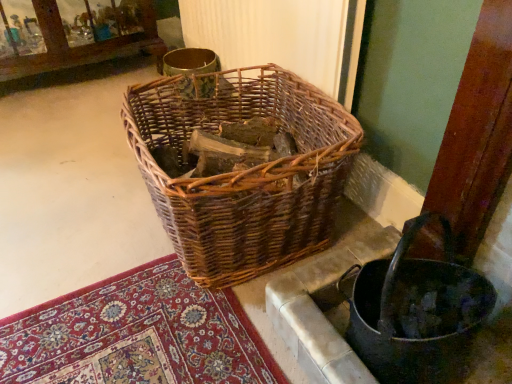
Describe the element at coordinates (244, 172) in the screenshot. Image resolution: width=512 pixels, height=384 pixels. I see `woven brown basket at center` at that location.

Image resolution: width=512 pixels, height=384 pixels. What are the coordinates of `woven brown basket at center` in the screenshot? It's located at (244, 172).

Identify the location of woven wood basket at lower right. (417, 312).

Image resolution: width=512 pixels, height=384 pixels. What do you see at coordinates (417, 312) in the screenshot? I see `woven wood basket at lower right` at bounding box center [417, 312].

What is the approximate width of woven wood basket at lower right?

woven wood basket at lower right is 9.78 inches wide.

You are a GUI agent. You are given a task and a screenshot of the screen. Output one action in this format:
    pyautogui.click(x=<x>, y=<y>)
    Task: Click on the woven brown basket at center
    This screenshot has width=512, height=384.
    Given the screenshot: What is the action you would take?
    pyautogui.click(x=244, y=172)

Which object is positioned more to the left, woven brown basket at center or woven wood basket at lower right?

From the viewer's perspective, woven brown basket at center appears more on the left side.

Is woven brown basket at center in front of or behind woven wood basket at lower right in the image?

Clearly, woven brown basket at center is behind woven wood basket at lower right.

Considering the positions of point (221, 243) and point (452, 324), is point (221, 243) closer or farther from the camera than point (452, 324)?

Point (221, 243).

From the image's perspective, is woven brown basket at center on woven wood basket at lower right?

Yes.

From a real-world perspective, is woven brown basket at center positioned above or below woven wood basket at lower right?

Clearly, from a real-world perspective, woven brown basket at center is above woven wood basket at lower right.

Considering the sizes of objects woven brown basket at center and woven wood basket at lower right in the image provided, who is wider, woven brown basket at center or woven wood basket at lower right?

woven brown basket at center.

Which of these two, woven brown basket at center or woven wood basket at lower right, stands taller?

With more height is woven brown basket at center.

Considering the sizes of woven brown basket at center and woven wood basket at lower right in the image, is woven brown basket at center bigger or smaller than woven wood basket at lower right?

Considering their sizes, woven brown basket at center takes up more space than woven wood basket at lower right.

Can we say woven brown basket at center lies outside woven wood basket at lower right?

Indeed, woven brown basket at center is completely outside woven wood basket at lower right.

Is the surface of woven brown basket at center in direct contact with woven wood basket at lower right?

woven brown basket at center and woven wood basket at lower right are not in contact.

Does woven brown basket at center turn towards woven wood basket at lower right?

No, woven brown basket at center is not oriented towards woven wood basket at lower right.

How many degrees apart are the facing directions of woven brown basket at center and woven wood basket at lower right?

The facing directions of woven brown basket at center and woven wood basket at lower right are 2.5 degrees apart.

Measure the distance from woven brown basket at center to woven wood basket at lower right.

woven brown basket at center is 13.98 inches from woven wood basket at lower right.

The width and height of the screenshot is (512, 384). In order to click on picnic basket on the left side of woven wood basket at lower right in this screenshot , I will do `click(244, 172)`.

Considering the relative positions of woven wood basket at lower right and woven brown basket at center in the image provided, is woven wood basket at lower right to the right of woven brown basket at center from the viewer's perspective?

Yes, woven wood basket at lower right is to the right of woven brown basket at center.

Which object is closer to the camera, woven wood basket at lower right or woven brown basket at center?

woven wood basket at lower right is closer to the camera.

Does point (389, 282) appear closer or farther from the camera than point (143, 117)?

Clearly, point (389, 282) is closer to the camera than point (143, 117).

From the image's perspective, is woven wood basket at lower right on woven brown basket at center?

Incorrect, from the image's perspective, woven wood basket at lower right is lower than woven brown basket at center.

From a real-world perspective, is woven wood basket at lower right positioned over woven brown basket at center based on gravity?

Actually, woven wood basket at lower right is physically below woven brown basket at center in the real world.

Considering the sizes of objects woven wood basket at lower right and woven brown basket at center in the image provided, who is wider, woven wood basket at lower right or woven brown basket at center?

Wider between the two is woven brown basket at center.

Between woven wood basket at lower right and woven brown basket at center, which one has less height?

With less height is woven wood basket at lower right.

Does woven wood basket at lower right have a larger size compared to woven brown basket at center?

Actually, woven wood basket at lower right might be smaller than woven brown basket at center.

Based on the photo, is woven wood basket at lower right outside of woven brown basket at center?

Indeed, woven wood basket at lower right is completely outside woven brown basket at center.

Is woven wood basket at lower right far from woven brown basket at center?

woven wood basket at lower right is actually quite close to woven brown basket at center.

Is woven brown basket at center at the back of woven wood basket at lower right?

No.

How different are the orientations of woven wood basket at lower right and woven brown basket at center in degrees?

The angular difference between woven wood basket at lower right and woven brown basket at center is 2.5 degrees.

Measure the distance between woven wood basket at lower right and woven brown basket at center.

13.98 inches.

You are a GUI agent. You are given a task and a screenshot of the screen. Output one action in this format:
    pyautogui.click(x=<x>, y=<y>)
    Task: Click on the basket container below the woven brown basket at center (from the image's perspective)
    The height and width of the screenshot is (384, 512).
    Given the screenshot: What is the action you would take?
    pyautogui.click(x=417, y=312)

You are a GUI agent. You are given a task and a screenshot of the screen. Output one action in this format:
    pyautogui.click(x=<x>, y=<y>)
    Task: Click on the basket container on the right side of woven brown basket at center
    
    Given the screenshot: What is the action you would take?
    pyautogui.click(x=417, y=312)

Locate an element on the screen. This screenshot has width=512, height=384. picnic basket located on the left of woven wood basket at lower right is located at coordinates (244, 172).